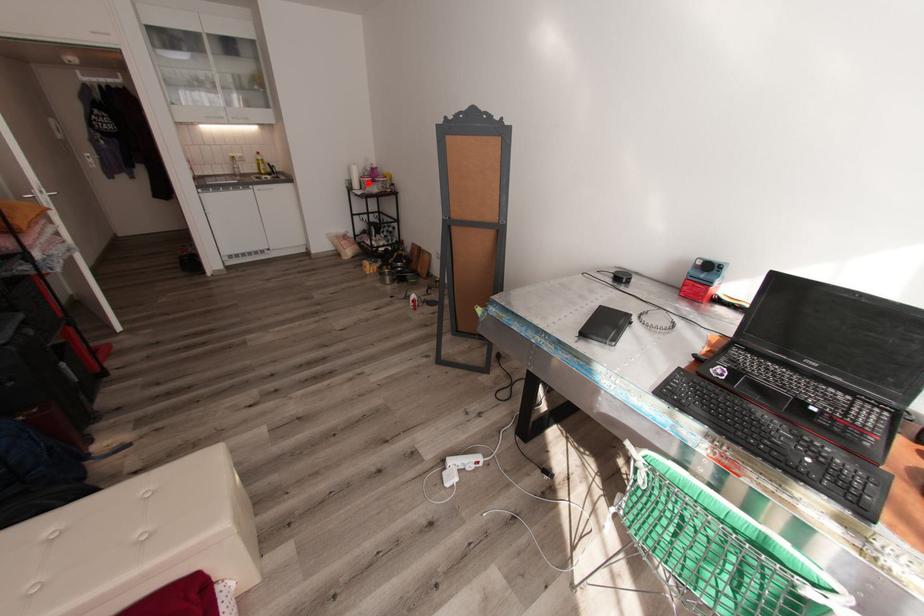
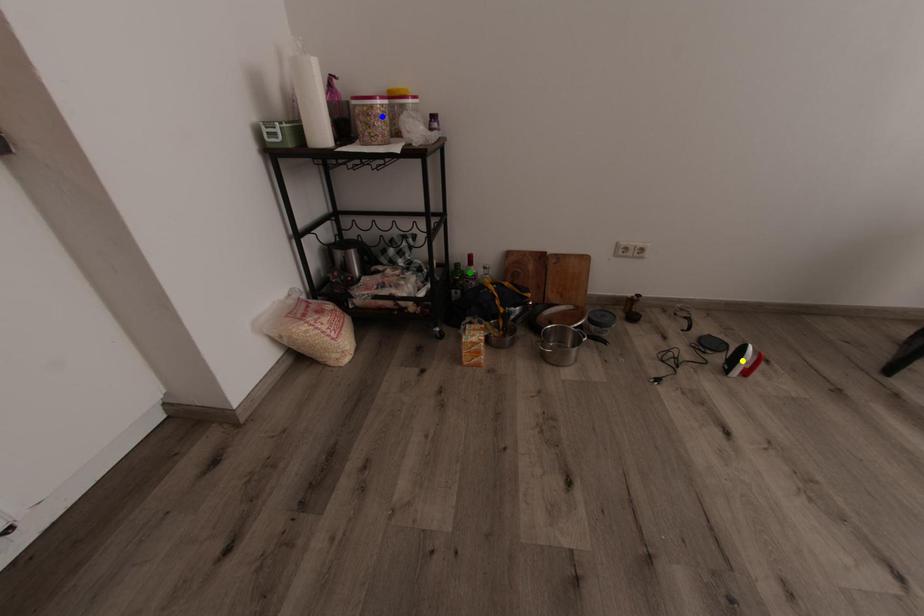
Question: I am providing you with two images of the same scene from different viewpoints. A red point is marked on the first image. You are given multiple points on the second image. Can you choose the point in image 2 that corresponds to the point in image 1?

Choices:
 (A) blue point
 (B) yellow point
 (C) green point

Answer: (A)